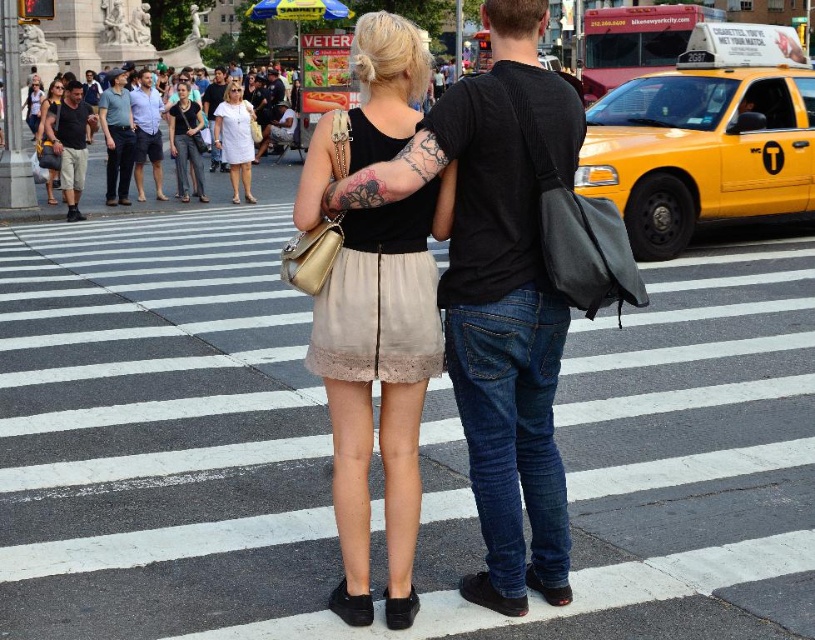
You are a fashion designer observing the scene. You notice a point at coordinates (380,381). What object in the scene corresponds to this point?

The point at coordinates (380,381) corresponds to the matte black tank top at center.

You are a delivery person trying to locate a specific delivery point marked at point (186, 141). Which object is exactly at that coordinate?

The matte black shirt at center is located at point (186, 141).

You are standing on the street and want to reach the point at coordinates point (192, 150). If your walking speed is 1.5 meters per second, how many seconds will it take you to reach that point?

The distance to point (192, 150) is 29.48 meters. At a speed of 1.5 meters per second, it would take approximately 19.65 seconds to reach the point.